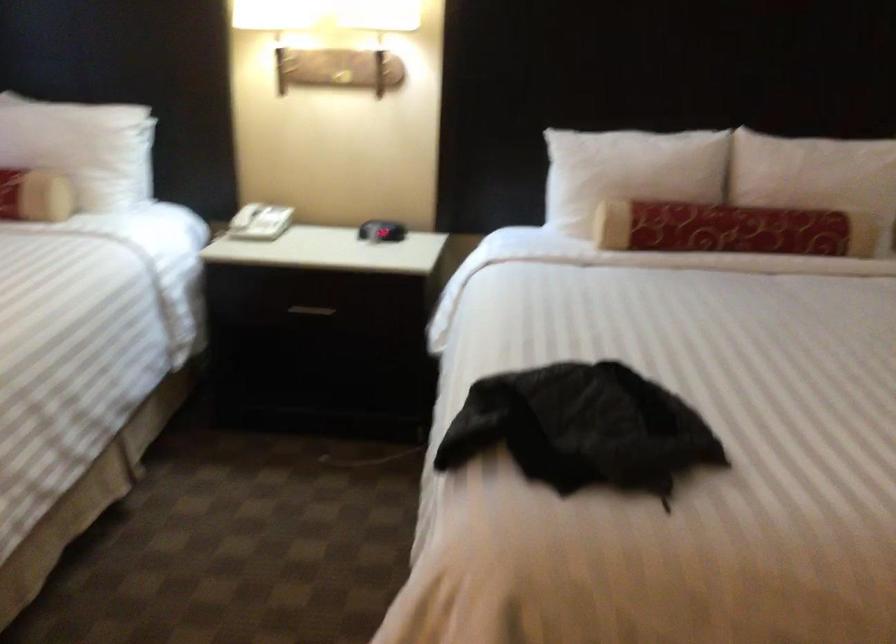
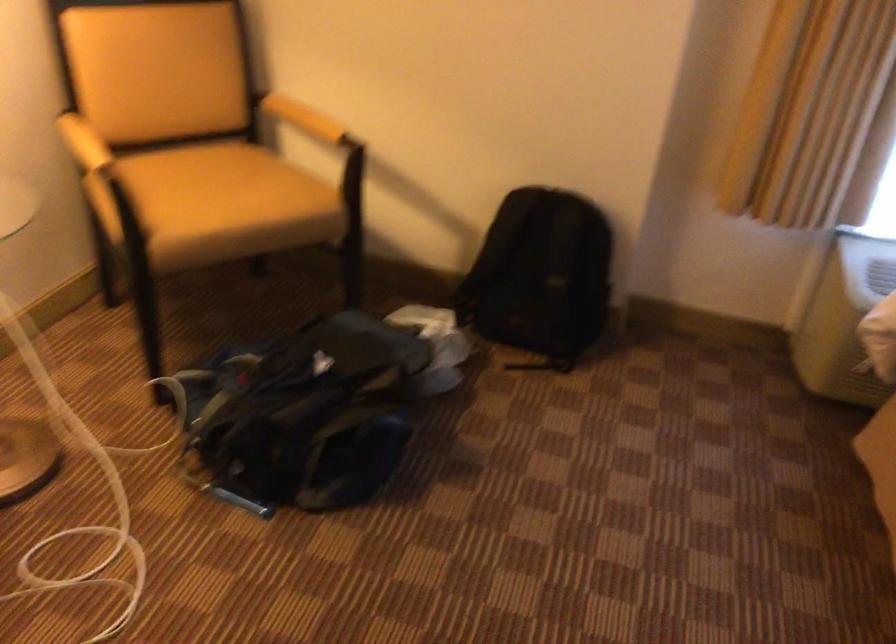
First-person continuous shooting, in which direction is the camera rotating?

The rotation direction of the camera is left-down.